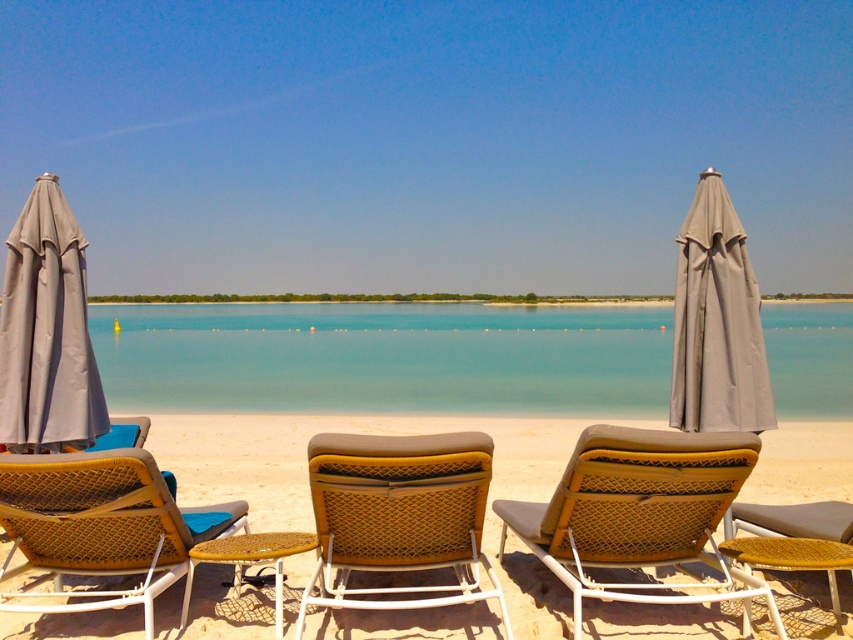
You are standing at the origin point in the beach scene. You see two points marked as point 1 at coordinates point (10, 262) and point 2 at coordinates point (741, 317). Which point is closer to you?

Point 2 at coordinates point (741, 317) is closer to you because it is in front of point 1 at coordinates point (10, 262).

You are a beachgoer who wants to place a small cooler between the beige sand at center and the brown woven beach chair at center. Which object should you place the cooler closer to so that it doesn

The beige sand at center is larger in size than the brown woven beach chair at center, so you should place the cooler closer to the beige sand at center to ensure it fits properly.